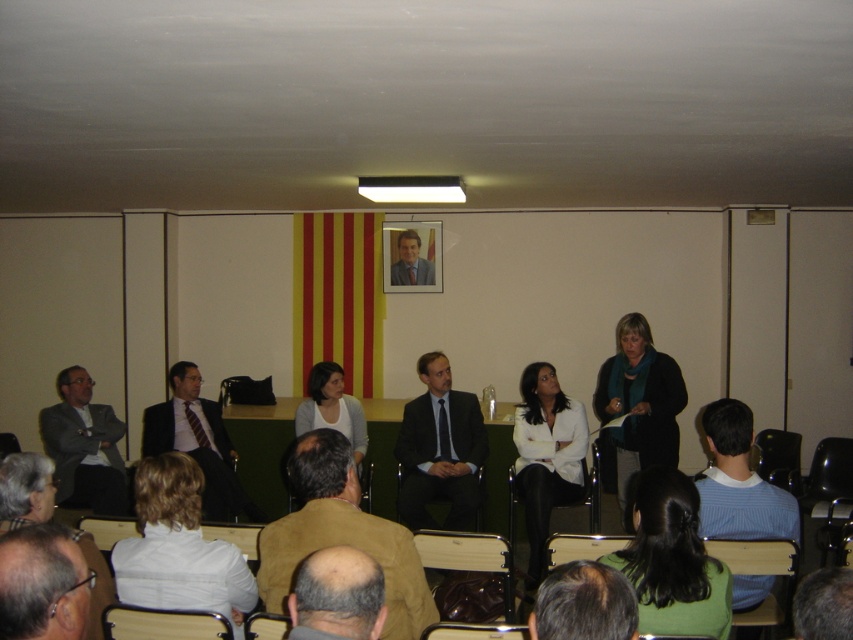
You are standing at the back of the conference room and want to walk to the point that is closer to the front. Which point should you go to, point (80, 588) or point (321, 602)?

Point (80, 588) is in front of point (321, 602), so you should go to point (80, 588) to reach the closer one to the front.

You are an event organizer who needs to adjust seating arrangements. You have a narrow chair that can only accommodate items with a width of 30 cm. The brown leather jacket at lower left and the bald head at lower center are currently occupying two seats. Which of these two items should you move to ensure they fit comfortably in the narrow chair?

The brown leather jacket at lower left has a lesser width compared to the bald head at lower center, so it should be moved to the narrow chair since it is narrower and will fit better.